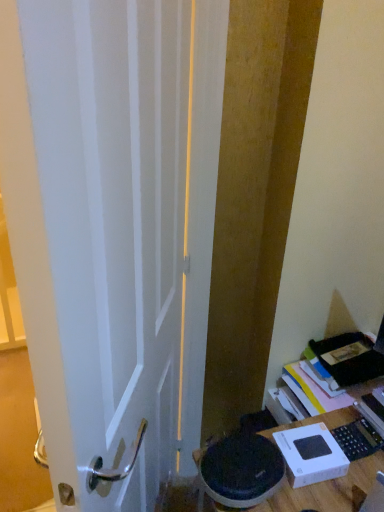
Question: Considering the relative positions of white glossy door at center and white cardboard box at lower right in the image provided, is white glossy door at center to the left of white cardboard box at lower right from the viewer's perspective?

Choices:
 (A) yes
 (B) no

Answer: (A)

Question: Is white glossy door at center outside of white cardboard box at lower right?

Choices:
 (A) no
 (B) yes

Answer: (B)

Question: Considering the relative sizes of white glossy door at center and white cardboard box at lower right in the image provided, is white glossy door at center thinner than white cardboard box at lower right?

Choices:
 (A) no
 (B) yes

Answer: (B)

Question: Can you confirm if white glossy door at center is bigger than white cardboard box at lower right?

Choices:
 (A) no
 (B) yes

Answer: (B)

Question: Is white glossy door at center wider than white cardboard box at lower right?

Choices:
 (A) no
 (B) yes

Answer: (A)

Question: From the image's perspective, would you say white glossy door at center is shown under white cardboard box at lower right?

Choices:
 (A) yes
 (B) no

Answer: (B)

Question: Can you confirm if white cardboard box at lower right is positioned to the left of white glossy door at center?

Choices:
 (A) no
 (B) yes

Answer: (A)

Question: Does white cardboard box at lower right have a lesser height compared to white glossy door at center?

Choices:
 (A) yes
 (B) no

Answer: (A)

Question: From the image's perspective, is white cardboard box at lower right above white glossy door at center?

Choices:
 (A) no
 (B) yes

Answer: (A)

Question: From the image's perspective, is white cardboard box at lower right under white glossy door at center?

Choices:
 (A) yes
 (B) no

Answer: (A)

Question: Could you tell me if white cardboard box at lower right is facing white glossy door at center?

Choices:
 (A) yes
 (B) no

Answer: (B)

Question: Is white cardboard box at lower right wider than white glossy door at center?

Choices:
 (A) yes
 (B) no

Answer: (A)

Question: From a real-world perspective, is white glossy door at center above or below white cardboard box at lower right?

Choices:
 (A) above
 (B) below

Answer: (A)